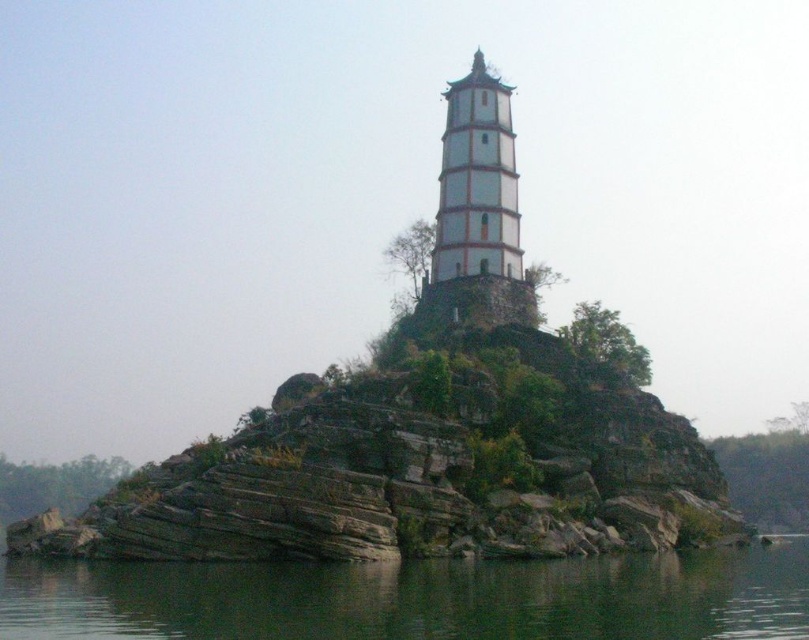
Based on the photo, does greenish water at lower center have a greater height compared to white stone tower at center?

In fact, greenish water at lower center may be shorter than white stone tower at center.

Which is behind, point (227, 582) or point (435, 252)?

Positioned behind is point (435, 252).

The width and height of the screenshot is (809, 640). Find the location of `greenish water at lower center`. greenish water at lower center is located at coordinates (417, 598).